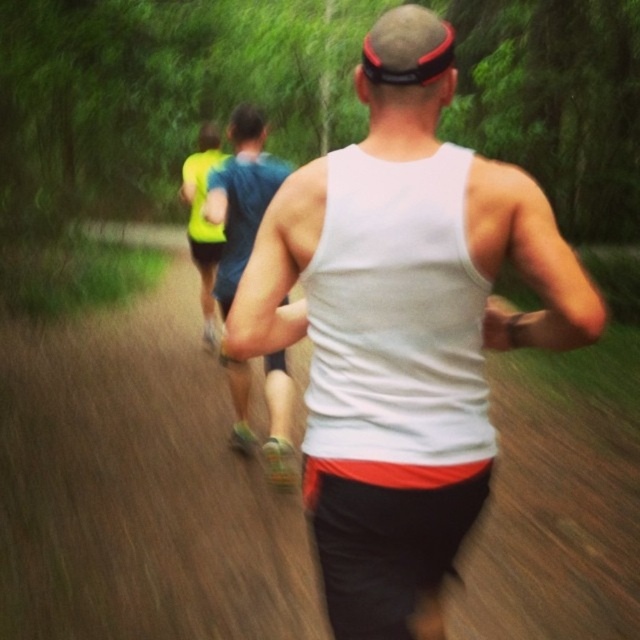
You are a photographer trying to capture the runner in the white matte tank top at center and the runner in the blue fabric shirt at center. Which runner is positioned higher in the frame?

The white matte tank top at center is located above the blue fabric shirt at center, so the runner in the white matte tank top at center is positioned higher in the frame.